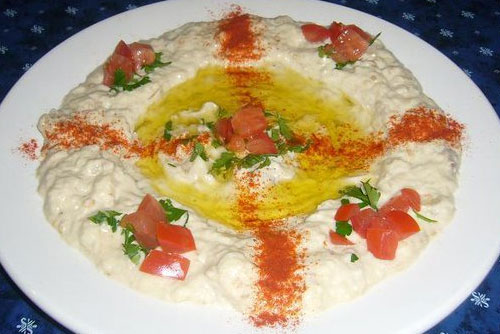
In order to click on white plate in this screenshot , I will do `click(78, 296)`, `click(27, 207)`, `click(56, 75)`, `click(438, 78)`, `click(479, 238)`, `click(390, 306)`.